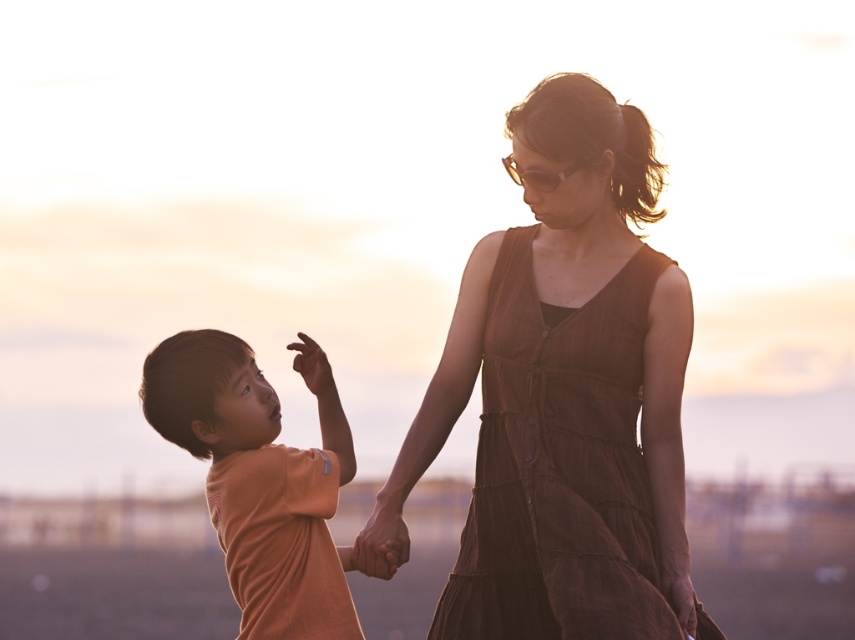
You are a fashion designer observing the image. You need to create a new outfit that matches the size of the brown textured dress at center with the orange cotton shirt at left. Is this possible?

The brown textured dress at center is bigger than orange cotton shirt at left. Therefore, it is not possible to create an outfit that matches their sizes since the dress is larger.

You are a photographer adjusting your camera settings to focus on the orange cotton shirt at left. What are the coordinates where you should aim your camera?

The orange cotton shirt at left is located at point (261, 480), so aim your camera at those coordinates to focus on it.

You are a photographer analyzing the composition of this image. The scene includes a child on the left and an adult on the right. There is a point marked at coordinates point (x=559, y=467). What object does this point correspond to?

The point (x=559, y=467) corresponds to the brown textured dress at center.